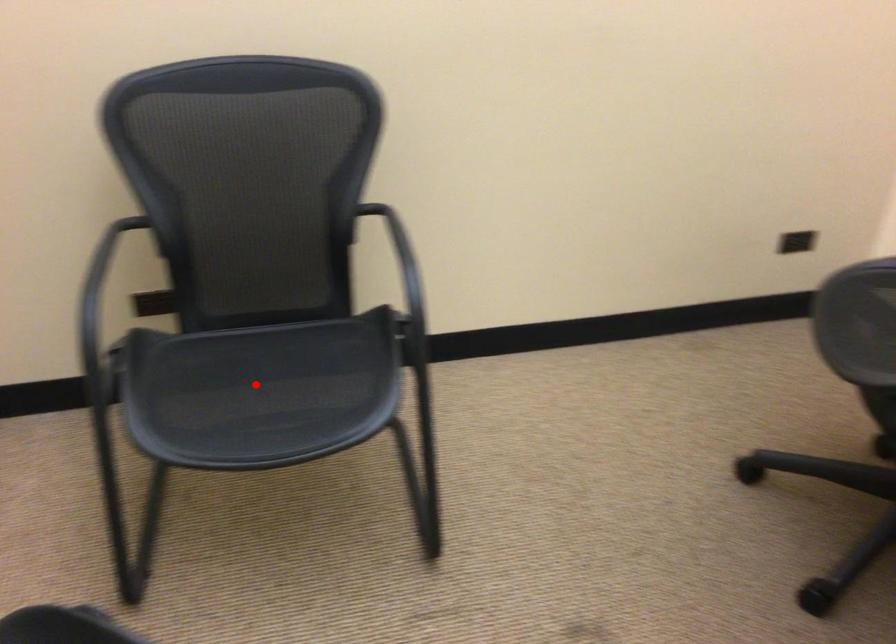
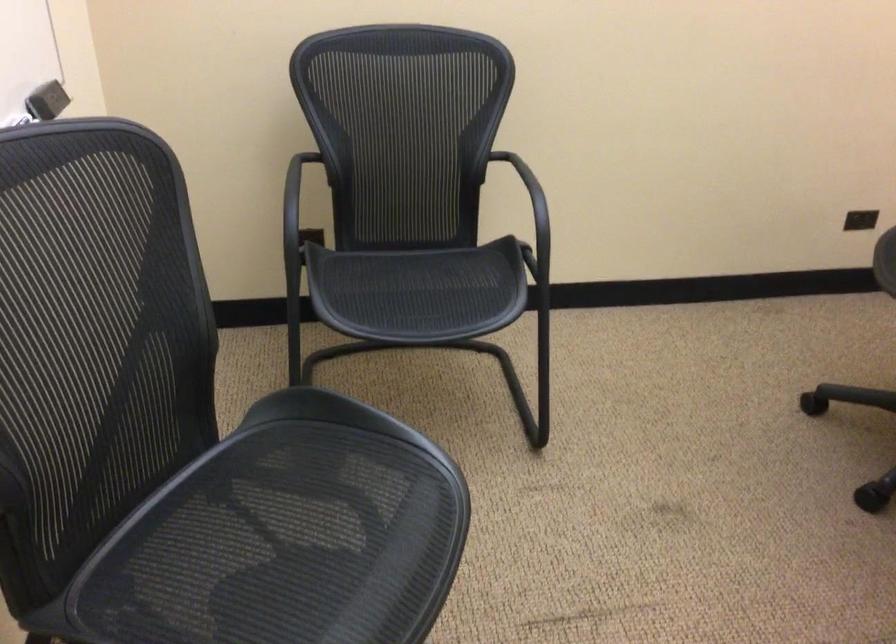
Question: I am providing you with two images of the same scene from different viewpoints. Image1 has a red point marked. In image2, the corresponding 3D location appears at what relative position? Reply with the corresponding letter.

Choices:
 (A) Closer
 (B) Farther

Answer: (B)